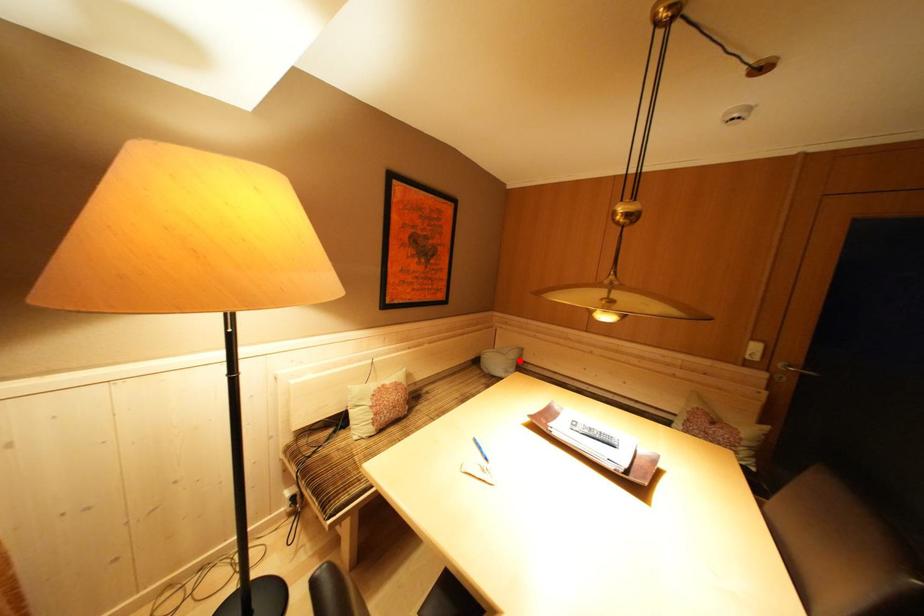
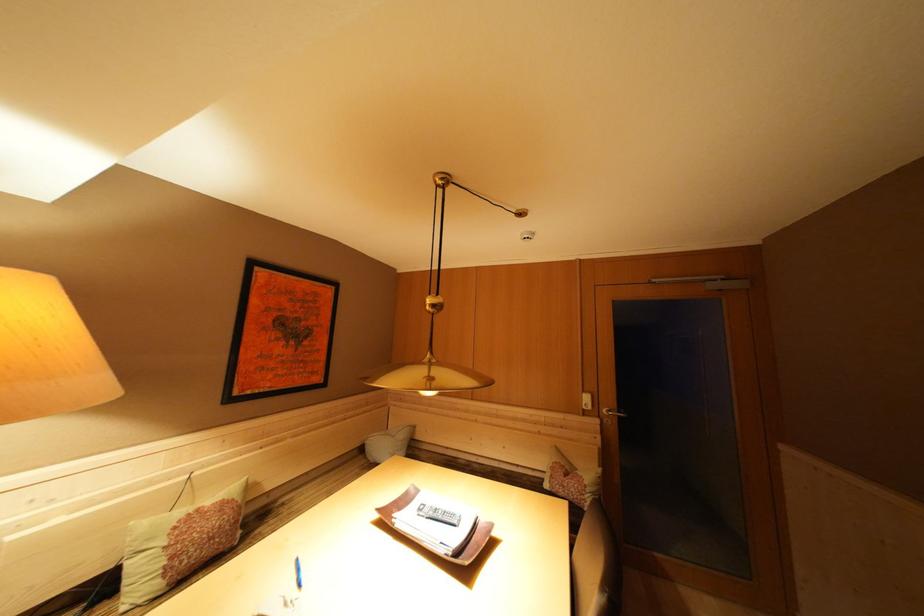
The point at the highlighted location is marked in the first image. Where is the corresponding point in the second image?

(408, 440)